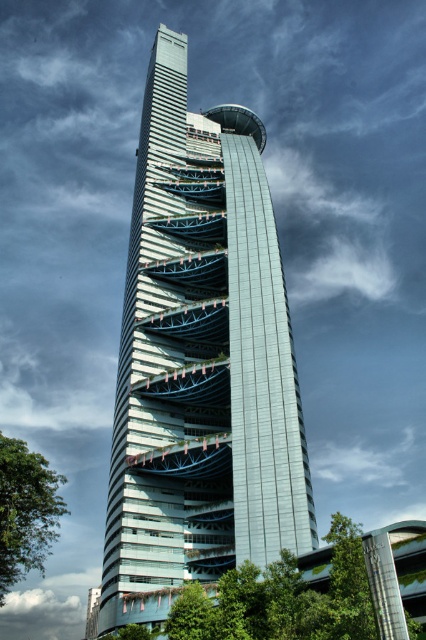
You are standing at a viewpoint 150 feet away from the glassy teal skyscraper at center. Can you comfortably view the entire building without moving your head?

The distance between you and the glassy teal skyscraper at center is 153.95 feet, which is slightly farther than 150 feet. Since the exact distance is just over the 150 feet mark, you might not be able to comfortably view the entire building without moving your head.

You are standing at the base of the glassy teal skyscraper at center and want to take a photo of the green leafy tree at lower left. Since the tree is partially obscured by the building, which direction should you move to get a clear view?

The glassy teal skyscraper at center is taller than the green leafy tree at lower left, so moving to the left side of the skyscraper would allow you to see the green leafy tree at lower left without obstruction.